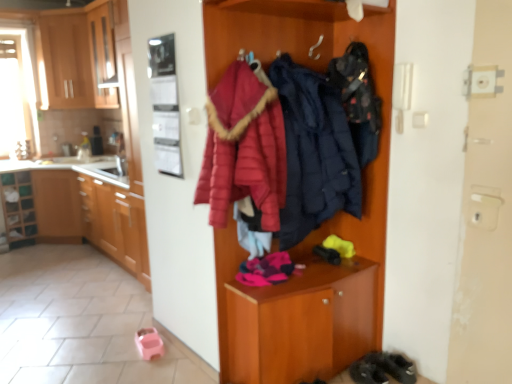
Image resolution: width=512 pixels, height=384 pixels. I want to click on wooden cabinet at center, so click(322, 224).

What is the approximate width of wooden cabinet at upper left, acting as the 1th cabinetry starting from the top?

It is 22.15 inches.

Where is `wooden shelf at left`? wooden shelf at left is located at coordinates (18, 208).

The height and width of the screenshot is (384, 512). In order to click on matte red bathrobe at center in this screenshot , I will do `click(244, 148)`.

Where is `white glossy countertop at left`? The width and height of the screenshot is (512, 384). white glossy countertop at left is located at coordinates (51, 163).

Is wooden cabinets at left, which is the second cabinetry in bottom-to-top order, oriented away from metallic refrigerator at upper left?

No, wooden cabinets at left, which is the second cabinetry in bottom-to-top order, is not facing the opposite direction of metallic refrigerator at upper left.

Is wooden cabinets at left, which is the second cabinetry in bottom-to-top order, bigger or smaller than metallic refrigerator at upper left?

Clearly, wooden cabinets at left, which is the second cabinetry in bottom-to-top order, is larger in size than metallic refrigerator at upper left.

Which of these two, wooden cabinets at left, which is the second cabinetry in bottom-to-top order, or metallic refrigerator at upper left, is wider?

With larger width is wooden cabinets at left, which is the second cabinetry in bottom-to-top order.

From a real-world perspective, which cabinetry is the 2nd one underneath the metallic refrigerator at upper left? Please provide its 2D coordinates.

[(87, 209)]

Can you tell me how much metallic refrigerator at upper left and matte red bathrobe at center differ in facing direction?

They differ by 91.5 degrees in their facing directions.

From a real-world perspective, which object stands above the other?

Answer: From a 3D spatial view, metallic refrigerator at upper left is above.

Considering the relative positions of metallic refrigerator at upper left and matte red bathrobe at center in the image provided, is metallic refrigerator at upper left to the left of matte red bathrobe at center from the viewer's perspective?

Correct, you'll find metallic refrigerator at upper left to the left of matte red bathrobe at center.

From the image's perspective, is dark gray suede shoes at lower right positioned above or below wooden cabinet at upper left, the third cabinetry from the bottom?

Based on their image positions, dark gray suede shoes at lower right is located beneath wooden cabinet at upper left, the third cabinetry from the bottom.

Considering the sizes of objects dark gray suede shoes at lower right and wooden cabinet at upper left, the third cabinetry from the bottom, in the image provided, who is shorter, dark gray suede shoes at lower right or wooden cabinet at upper left, the third cabinetry from the bottom,?

Standing shorter between the two is dark gray suede shoes at lower right.

Can you tell me how much dark gray suede shoes at lower right and wooden cabinet at upper left, acting as the 1th cabinetry starting from the top, differ in facing direction?

The angle between the facing direction of dark gray suede shoes at lower right and the facing direction of wooden cabinet at upper left, acting as the 1th cabinetry starting from the top, is 37.8 degrees.

In the scene shown: Does dark gray suede shoes at lower right have a larger size compared to wooden cabinet at upper left, the third cabinetry from the bottom?

No.

From a real-world perspective, which object stands above the other?

From a 3D spatial view, dark blue quilted jacket at center, the first clothing from the right, is above.

Could you measure the distance between dark blue quilted jacket at center, the first clothing from the right, and matte wood cabinets at left, the 3th cabinetry in the top-to-bottom sequence?

dark blue quilted jacket at center, the first clothing from the right, is 2.05 meters away from matte wood cabinets at left, the 3th cabinetry in the top-to-bottom sequence.

In the image, is dark blue quilted jacket at center, the second clothing positioned from the left, positioned in front of or behind matte wood cabinets at left, the 3th cabinetry in the top-to-bottom sequence?

Visually, dark blue quilted jacket at center, the second clothing positioned from the left, is located in front of matte wood cabinets at left, the 3th cabinetry in the top-to-bottom sequence.

Is dark blue quilted jacket at center, the first clothing from the right, far from matte wood cabinets at left, the 3th cabinetry in the top-to-bottom sequence?

dark blue quilted jacket at center, the first clothing from the right, is far away from matte wood cabinets at left, the 3th cabinetry in the top-to-bottom sequence.

Is wooden cabinet at upper left, acting as the 1th cabinetry starting from the top, positioned far away from dark gray suede shoes at lower right?

Yes, wooden cabinet at upper left, acting as the 1th cabinetry starting from the top, and dark gray suede shoes at lower right are quite far apart.

Is wooden cabinet at upper left, the third cabinetry from the bottom, aimed at dark gray suede shoes at lower right?

No.

From the image's perspective, which is below, wooden cabinet at upper left, the third cabinetry from the bottom, or dark gray suede shoes at lower right?

dark gray suede shoes at lower right appears lower in the image.

Where is `cabinetry that is the 3rd one when counting backward from the dark gray suede shoes at lower right`? Image resolution: width=512 pixels, height=384 pixels. cabinetry that is the 3rd one when counting backward from the dark gray suede shoes at lower right is located at coordinates (77, 59).

From a real-world perspective, is metallic refrigerator at upper left physically located above or below wooden cabinet at center?

From a real-world perspective, metallic refrigerator at upper left is physically above wooden cabinet at center.

You are a GUI agent. You are given a task and a screenshot of the screen. Output one action in this format:
    pyautogui.click(x=<x>, y=<y>)
    Task: Click on the dresser on the right of metallic refrigerator at upper left
    This screenshot has width=512, height=384.
    Given the screenshot: What is the action you would take?
    pyautogui.click(x=322, y=224)

Consider the image. Is metallic refrigerator at upper left far away from wooden cabinet at center?

metallic refrigerator at upper left is actually quite close to wooden cabinet at center.

In terms of width, does wooden cabinets at left, which is the second cabinetry in bottom-to-top order, look wider or thinner when compared to matte blue puffer jacket at center, marked as the 2th clothing in a right-to-left arrangement?

In the image, wooden cabinets at left, which is the second cabinetry in bottom-to-top order, appears to be wider than matte blue puffer jacket at center, marked as the 2th clothing in a right-to-left arrangement.

Is wooden cabinets at left, marked as the second cabinetry in a top-to-bottom arrangement, turned away from matte blue puffer jacket at center, marked as the 2th clothing in a right-to-left arrangement?

wooden cabinets at left, marked as the second cabinetry in a top-to-bottom arrangement, is not turned away from matte blue puffer jacket at center, marked as the 2th clothing in a right-to-left arrangement.

Consider the image. How many degrees apart are the facing directions of wooden cabinets at left, marked as the second cabinetry in a top-to-bottom arrangement, and matte blue puffer jacket at center, marked as the 2th clothing in a right-to-left arrangement?

47.5 degrees separate the facing orientations of wooden cabinets at left, marked as the second cabinetry in a top-to-bottom arrangement, and matte blue puffer jacket at center, marked as the 2th clothing in a right-to-left arrangement.

Does point (79, 215) come closer to viewer compared to point (325, 161)?

No, (79, 215) is further to viewer.

Locate an element on the screen. This screenshot has width=512, height=384. appliance above the wooden cabinets at left, marked as the second cabinetry in a top-to-bottom arrangement (from a real-world perspective) is located at coordinates (165, 105).

Locate an element on the screen. bathrobe that appears below the metallic refrigerator at upper left (from the image's perspective) is located at coordinates (244, 148).

Which object lies further to the anchor point dark blue quilted jacket at center, the first clothing from the right, dark gray suede shoes at lower right or matte red bathrobe at center?

dark gray suede shoes at lower right lies further to dark blue quilted jacket at center, the first clothing from the right, than the other object.

Based on the photo, considering their positions, is dark blue quilted jacket at center, the first clothing from the right, positioned further to white glossy countertop at left than matte wood cabinets at left, the 1th cabinetry in the bottom-to-top sequence?

The object further to white glossy countertop at left is dark blue quilted jacket at center, the first clothing from the right.

Looking at the image, which one is located further to wooden shelf at left, wooden cabinets at left, which is the second cabinetry in bottom-to-top order, or wooden cabinet at center?

wooden cabinet at center lies further to wooden shelf at left than the other object.

Estimate the real-world distances between objects in this image. Which object is further from wooden cabinets at left, marked as the second cabinetry in a top-to-bottom arrangement, wooden shelf at left or dark gray suede shoes at lower right?

Based on the image, dark gray suede shoes at lower right appears to be further to wooden cabinets at left, marked as the second cabinetry in a top-to-bottom arrangement.

From the image, which object appears to be nearer to wooden cabinets at left, marked as the second cabinetry in a top-to-bottom arrangement, matte blue puffer jacket at center, which ranks as the 1th clothing in left-to-right order, or matte red bathrobe at center?

Among the two, matte red bathrobe at center is located nearer to wooden cabinets at left, marked as the second cabinetry in a top-to-bottom arrangement.

Looking at the image, which one is located further to dark blue quilted jacket at center, the first clothing from the right, wooden cabinet at center or wooden shelf at left?

Based on the image, wooden shelf at left appears to be further to dark blue quilted jacket at center, the first clothing from the right.

Looking at the image, which one is located closer to white glossy countertop at left, metallic refrigerator at upper left or wooden cabinet at upper left, the third cabinetry from the bottom?

Based on the image, wooden cabinet at upper left, the third cabinetry from the bottom, appears to be nearer to white glossy countertop at left.

Based on their spatial positions, is matte red bathrobe at center or wooden shelf at left closer to white glossy countertop at left?

The object closer to white glossy countertop at left is wooden shelf at left.

At what (x,y) coordinates should I click in order to perform the action: click on counter top between wooden cabinets at left, marked as the second cabinetry in a top-to-bottom arrangement, and dark gray suede shoes at lower right from left to right. Please return your answer as a coordinate pair (x, y). This screenshot has width=512, height=384. Looking at the image, I should click on (51, 163).

Locate an element on the screen. The image size is (512, 384). appliance positioned between wooden cabinet at center and white glossy countertop at left from near to far is located at coordinates (165, 105).

Image resolution: width=512 pixels, height=384 pixels. In order to click on appliance positioned between wooden cabinet at center and wooden cabinet at upper left, the third cabinetry from the bottom, from near to far in this screenshot , I will do `click(165, 105)`.

Locate an element on the screen. appliance located between wooden shelf at left and dark gray suede shoes at lower right in the left-right direction is located at coordinates (165, 105).